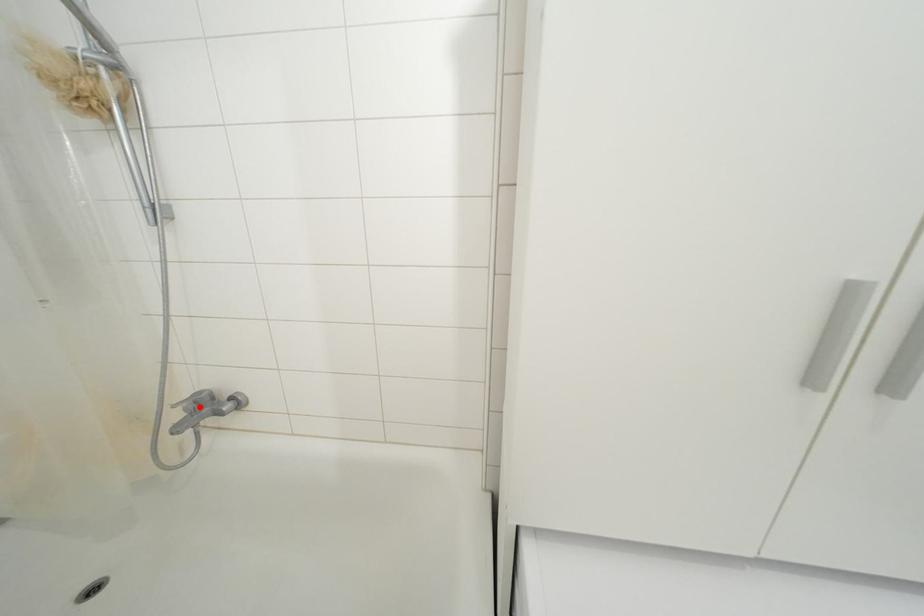
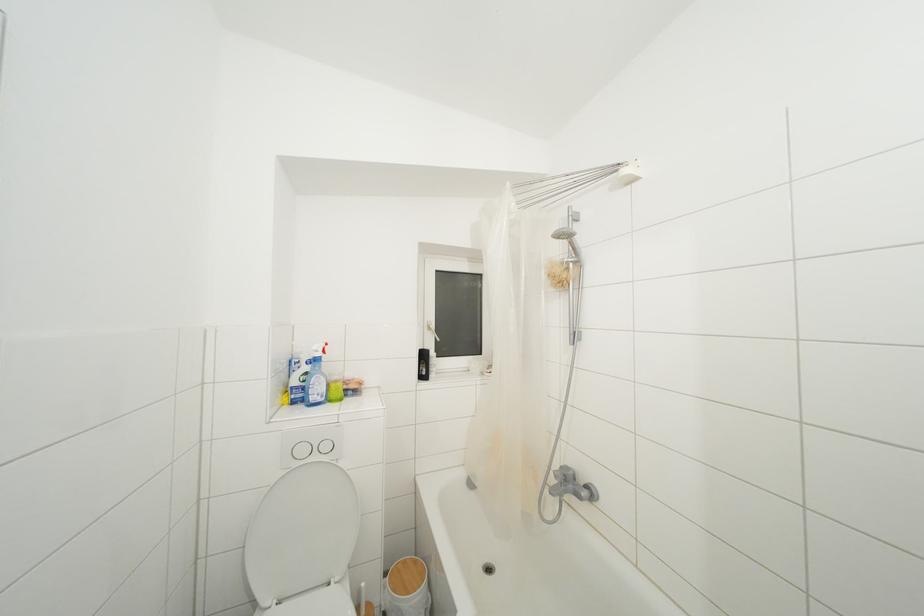
Find the pixel in the second image that matches the highlighted location in the first image.

(568, 480)